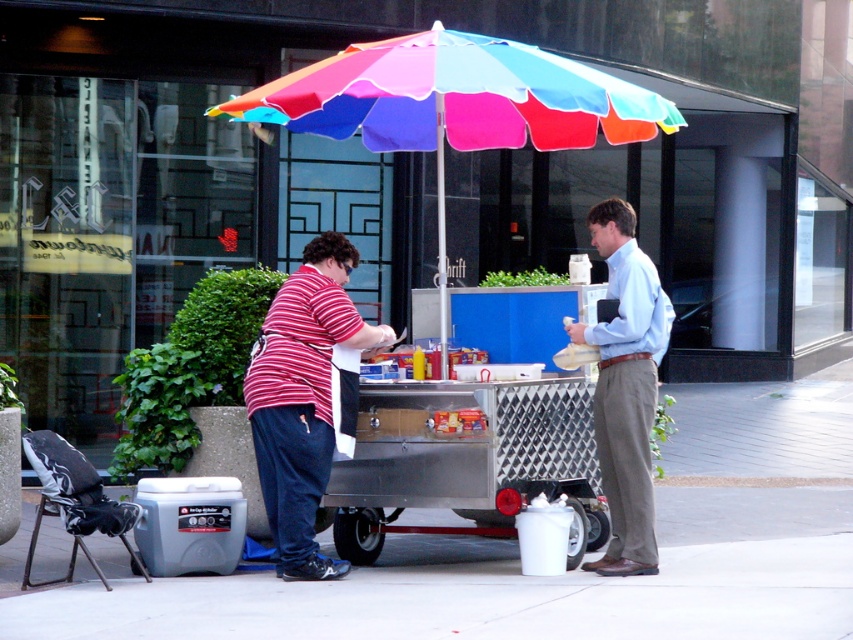
Can you confirm if rainbow fabric umbrella at center is wider than striped cotton shirt at center?

Yes, rainbow fabric umbrella at center is wider than striped cotton shirt at center.

Does point (430, 28) come in front of point (254, 413)?

That is False.

Between point (482, 138) and point (264, 365), which one is positioned behind?

Point (482, 138)

Locate an element on the screen. rainbow fabric umbrella at center is located at coordinates (456, 104).

Between striped cotton shirt at center and light blue shirt at center, which one appears on the right side from the viewer's perspective?

light blue shirt at center

Is point (268, 380) positioned behind point (628, 452)?

No, it is in front of (628, 452).

Locate an element on the screen. striped cotton shirt at center is located at coordinates (302, 397).

Locate an element on the screen. striped cotton shirt at center is located at coordinates (302, 397).

Between point (630, 134) and point (636, 307), which one is positioned behind?

Point (630, 134)

The width and height of the screenshot is (853, 640). Find the location of `rainbow fabric umbrella at center`. rainbow fabric umbrella at center is located at coordinates (456, 104).